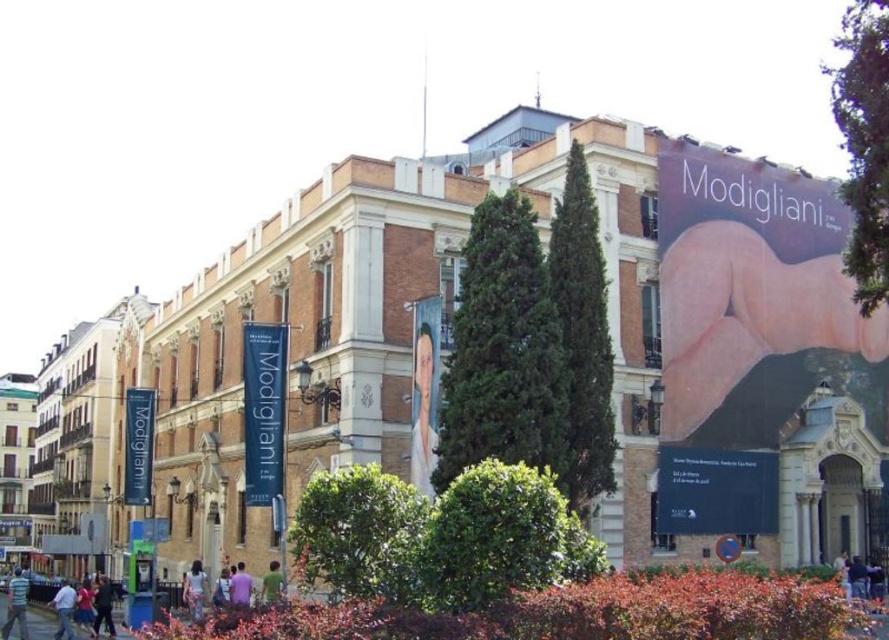
Question: Observing the image, what is the correct spatial positioning of purple matte shirt at lower center in reference to light brown leather jacket at lower center?

Choices:
 (A) left
 (B) right

Answer: (B)

Question: Can you confirm if floral dress at lower left is positioned above light brown hair at lower right?

Choices:
 (A) no
 (B) yes

Answer: (A)

Question: Which object is the closest to the green matte shirt at lower center?

Choices:
 (A) light blue jeans at lower left
 (B) purple matte shirt at lower center
 (C) dark blue jacket at lower left

Answer: (B)

Question: Which point appears farthest from the camera in this image?

Choices:
 (A) (236, 563)
 (B) (263, 573)
 (C) (190, 605)
 (D) (839, 568)

Answer: (A)

Question: Does dark blue jacket at lower left have a lesser width compared to light brown hair at lower right?

Choices:
 (A) no
 (B) yes

Answer: (A)

Question: Among these points, which one is nearest to the camera?

Choices:
 (A) (63, 600)
 (B) (194, 609)
 (C) (228, 580)
 (D) (276, 570)

Answer: (D)